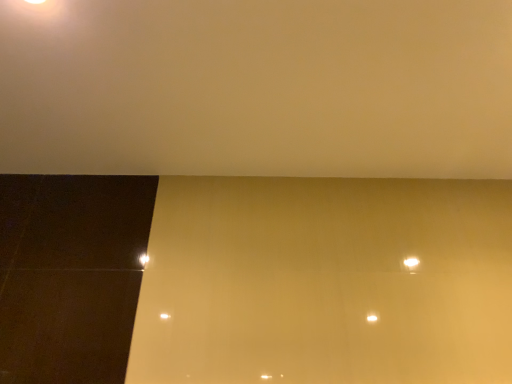
At what (x,y) coordinates should I click in order to perform the action: click on matte white wall at upper center. Please return your answer as a coordinate pair (x, y). The image size is (512, 384). Looking at the image, I should click on (257, 88).

What do you see at coordinates (257, 88) in the screenshot?
I see `matte white wall at upper center` at bounding box center [257, 88].

This screenshot has height=384, width=512. In order to click on matte white wall at upper center in this screenshot , I will do `click(257, 88)`.